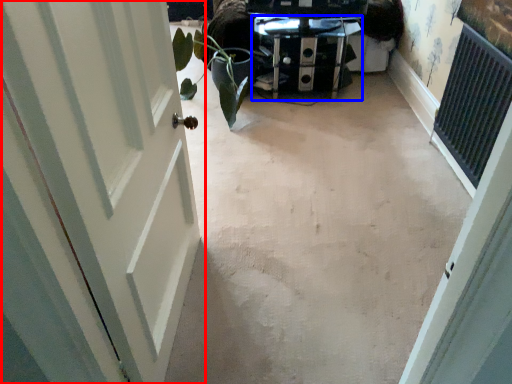
Question: Among these objects, which one is farthest to the camera, door (highlighted by a red box) or furniture (highlighted by a blue box)?

Choices:
 (A) door
 (B) furniture

Answer: (B)